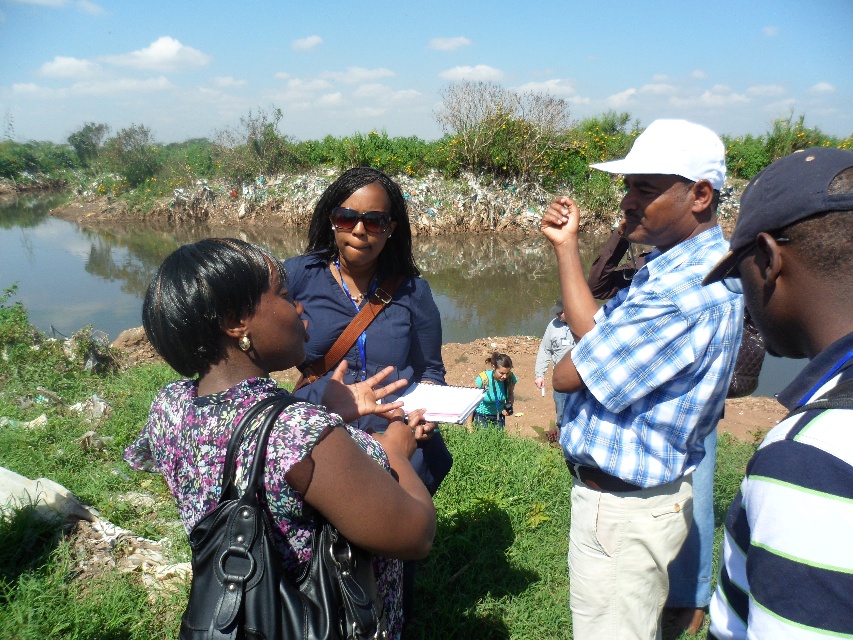
Which is above, floral fabric blouse at center or striped cotton shirt at right?

striped cotton shirt at right is higher up.

Consider the image. Does floral fabric blouse at center have a larger size compared to striped cotton shirt at right?

Incorrect, floral fabric blouse at center is not larger than striped cotton shirt at right.

Is point (190, 484) positioned behind point (838, 349)?

Yes.

I want to click on floral fabric blouse at center, so click(212, 358).

Who is lower down, floral fabric blouse at center or matte blue shirt at center?

floral fabric blouse at center

Does floral fabric blouse at center appear on the left side of matte blue shirt at center?

Correct, you'll find floral fabric blouse at center to the left of matte blue shirt at center.

Is point (171, 492) more distant than point (401, 243)?

That is False.

The height and width of the screenshot is (640, 853). Find the location of `floral fabric blouse at center`. floral fabric blouse at center is located at coordinates (212, 358).

Which of these two, blue plaid shirt at center or matte blue shirt at center, stands taller?

Standing taller between the two is blue plaid shirt at center.

You are a GUI agent. You are given a task and a screenshot of the screen. Output one action in this format:
    pyautogui.click(x=<x>, y=<y>)
    Task: Click on the blue plaid shirt at center
    Image resolution: width=853 pixels, height=640 pixels.
    Given the screenshot: What is the action you would take?
    pyautogui.click(x=642, y=378)

The height and width of the screenshot is (640, 853). Describe the element at coordinates (642, 378) in the screenshot. I see `blue plaid shirt at center` at that location.

Find the location of a particular element. blue plaid shirt at center is located at coordinates (642, 378).